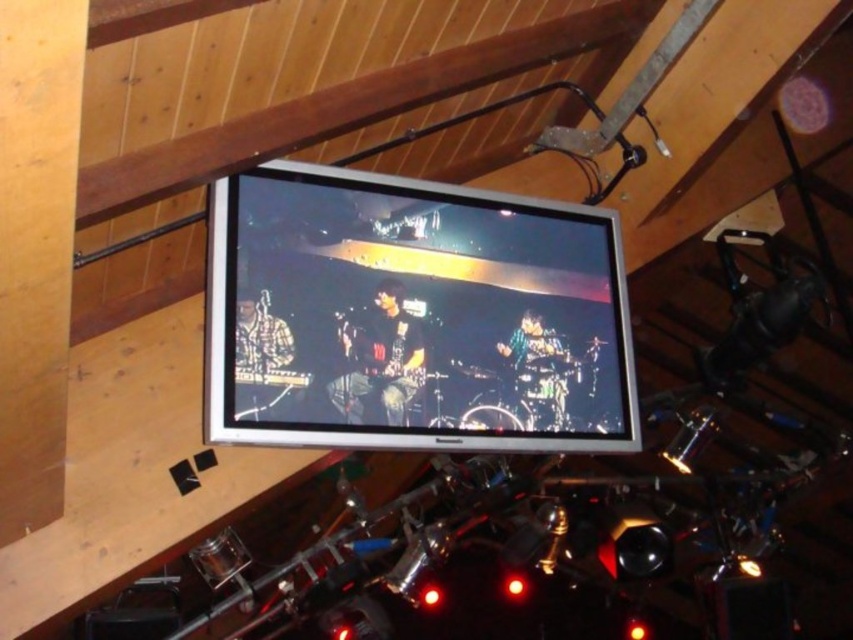
Which is behind, point (349, 397) or point (529, 332)?

The point (529, 332) is behind.

You are a GUI agent. You are given a task and a screenshot of the screen. Output one action in this format:
    pyautogui.click(x=<x>, y=<y>)
    Task: Click on the shiny black guitar at center
    This screenshot has height=640, width=853.
    Given the screenshot: What is the action you would take?
    pyautogui.click(x=379, y=356)

Does point (347, 336) come behind point (523, 330)?

No.

Where is `shiny black guitar at center`? The image size is (853, 640). shiny black guitar at center is located at coordinates (379, 356).

Which is more to the right, matte silver tv at upper center or shiny metallic drum set at center?

From the viewer's perspective, shiny metallic drum set at center appears more on the right side.

Between matte silver tv at upper center and shiny metallic drum set at center, which one appears on the left side from the viewer's perspective?

matte silver tv at upper center

Where is `matte silver tv at upper center`? Image resolution: width=853 pixels, height=640 pixels. matte silver tv at upper center is located at coordinates (412, 316).

The height and width of the screenshot is (640, 853). In order to click on matte silver tv at upper center in this screenshot , I will do `click(412, 316)`.

Which is behind, point (561, 262) or point (387, 332)?

Positioned behind is point (561, 262).

Who is higher up, matte silver tv at upper center or shiny black guitar at center?

matte silver tv at upper center is above.

Locate an element on the screen. matte silver tv at upper center is located at coordinates click(412, 316).